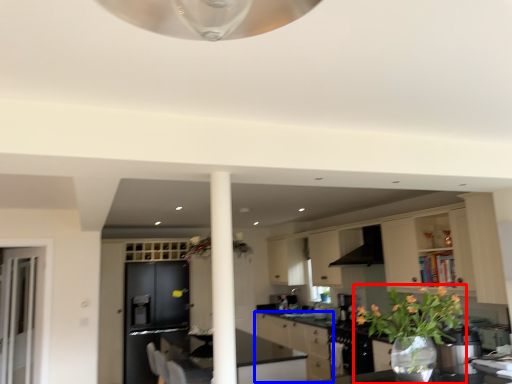
Question: Which object is further to the camera taking this photo, houseplant (highlighted by a red box) or cabinetry (highlighted by a blue box)?

Choices:
 (A) houseplant
 (B) cabinetry

Answer: (B)